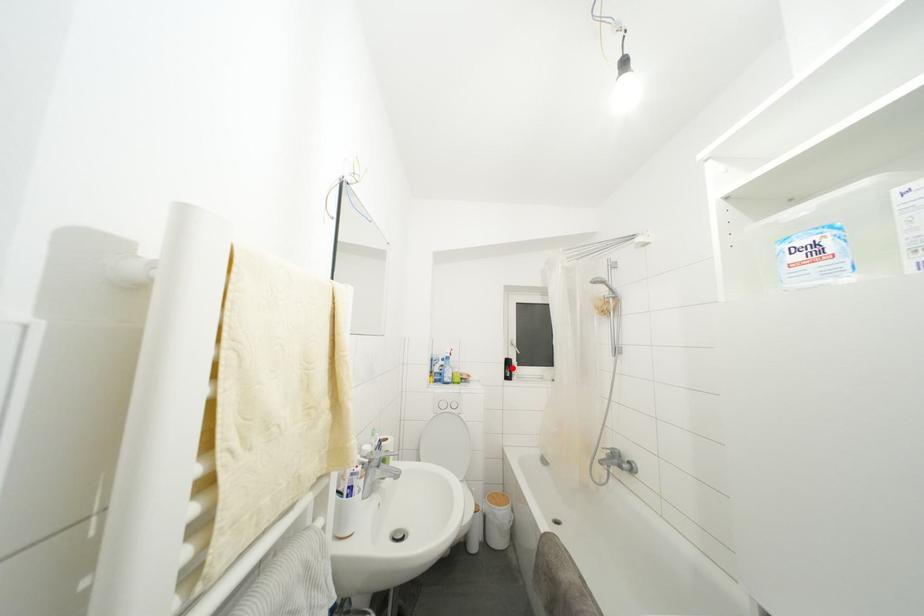
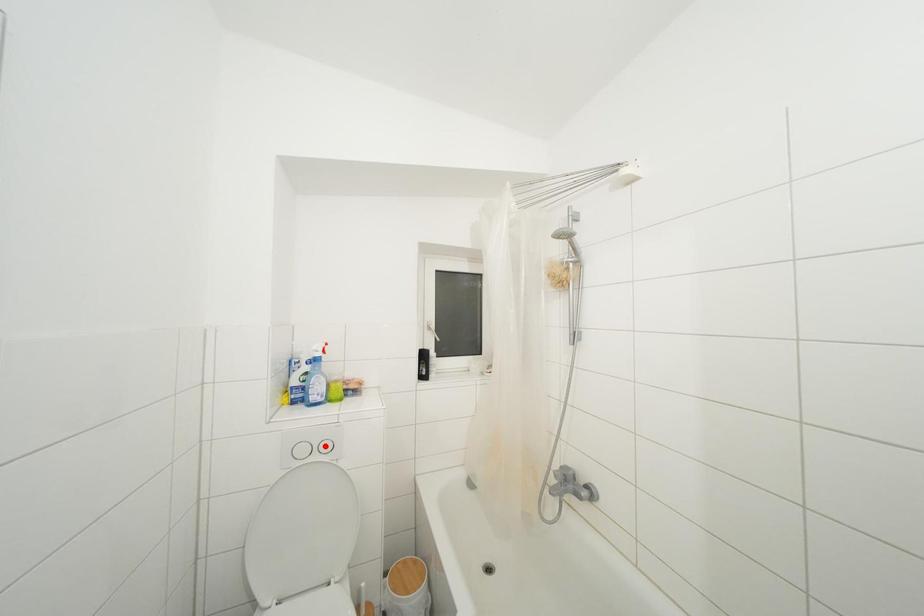
I am providing you with two images of the same scene from different viewpoints. A red point is marked on the first image and another point is marked on the second image. Do the highlighted points in image1 and image2 indicate the same real-world spot?

No